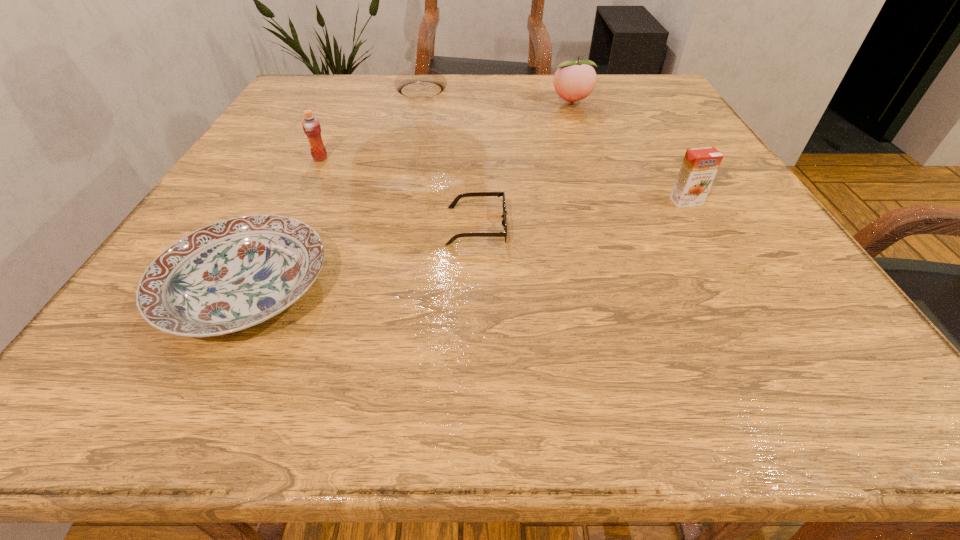
Where is `table lamp`? The image size is (960, 540). table lamp is located at coordinates (419, 82).

Find the location of a particular element. This screenshot has height=540, width=960. peach is located at coordinates (573, 81).

The image size is (960, 540). Identify the location of the farther orange juice. (311, 126).

Identify the location of the left orange juice. (311, 126).

Locate an element on the screen. This screenshot has width=960, height=540. the nearer orange juice is located at coordinates (699, 167).

At what (x,y) coordinates should I click in order to perform the action: click on the right orange juice. Please return your answer as a coordinate pair (x, y). Looking at the image, I should click on (699, 167).

You are a GUI agent. You are given a task and a screenshot of the screen. Output one action in this format:
    pyautogui.click(x=<x>, y=<y>)
    Task: Click on the plate
    This screenshot has height=540, width=960.
    Given the screenshot: What is the action you would take?
    233,274

Image resolution: width=960 pixels, height=540 pixels. Identify the location of sunglasses. (474, 194).

Where is `vacant space located 0.170m on the front-facing side of the table lamp`? This screenshot has width=960, height=540. vacant space located 0.170m on the front-facing side of the table lamp is located at coordinates (529, 90).

At what (x,y) coordinates should I click in order to perform the action: click on vacant space located on the front of the peach. Please return your answer as a coordinate pair (x, y). This screenshot has height=540, width=960. Looking at the image, I should click on (587, 147).